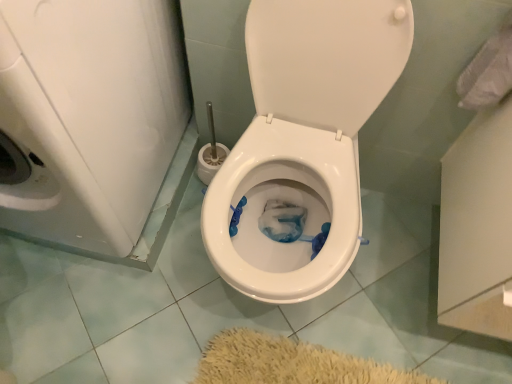
Identify the location of free location to the right of white glossy toilet at center. [394, 284].